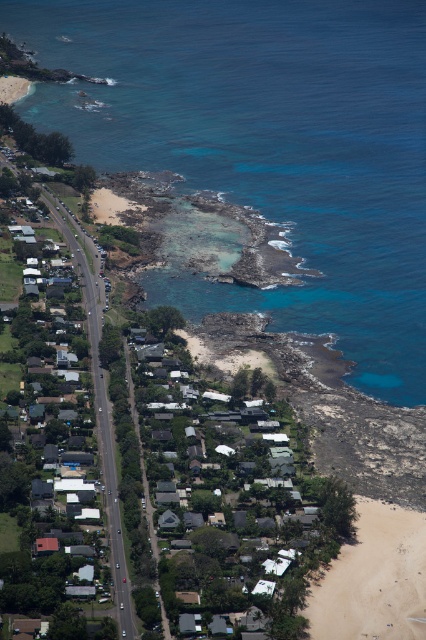
You are planning to build a small boat dock near the coast. You have two options for the location based on the image. The first option is near the blue clear water at center, and the second option is near the light brown sand at lower right. Considering the size of the areas, which location would provide more space for the dock?

The blue clear water at center has a larger size compared to the light brown sand at lower right, so the blue clear water at center would provide more space for the dock.

You are a drone operator flying over the coastal area. You need to capture a photo of the light brown sand at lower right and the blue clear water at center. From the drone camera perspective, which object will appear closer to the camera?

The blue clear water at center appears closer to the camera because the light brown sand at lower right is behind it.